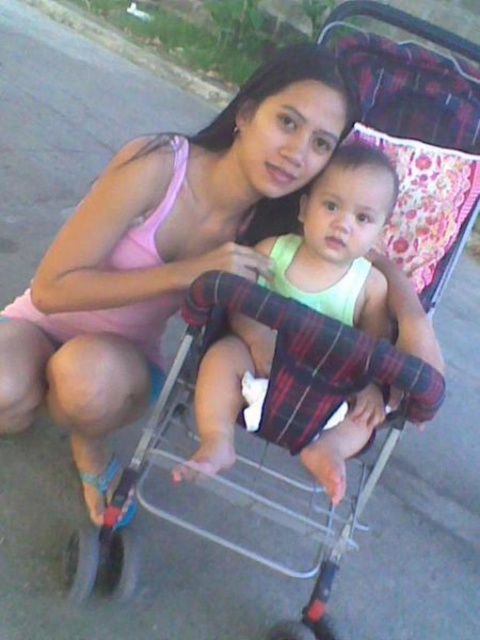
Does pink fabric at center appear over light green fabric baby at center?

Yes.

Is pink fabric at center positioned before light green fabric baby at center?

That is False.

Who is more distant from viewer, [175,184] or [319,308]?

Positioned behind is point [319,308].

At what (x,y) coordinates should I click in order to perform the action: click on pink fabric at center. Please return your answer as a coordinate pair (x, y). The width and height of the screenshot is (480, 640). Looking at the image, I should click on (160, 252).